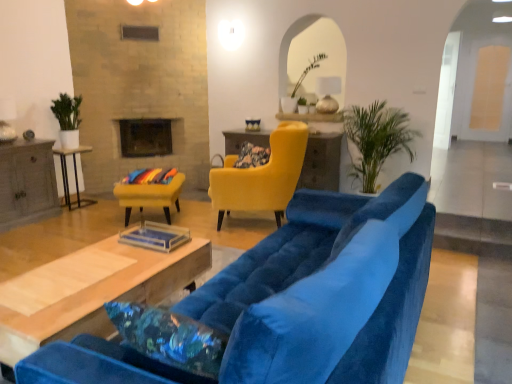
Question: Is matte yellow armchair at center, marked as the 2th chair in a left-to-right arrangement, to the right of black glass fireplace at upper center from the viewer's perspective?

Choices:
 (A) no
 (B) yes

Answer: (B)

Question: Is matte yellow armchair at center, marked as the 2th chair in a left-to-right arrangement, facing towards black glass fireplace at upper center?

Choices:
 (A) no
 (B) yes

Answer: (A)

Question: Can you confirm if matte yellow armchair at center, marked as the 2th chair in a left-to-right arrangement, is thinner than black glass fireplace at upper center?

Choices:
 (A) no
 (B) yes

Answer: (A)

Question: From the image's perspective, is matte yellow armchair at center, the 1th chair positioned from the right, over black glass fireplace at upper center?

Choices:
 (A) yes
 (B) no

Answer: (B)

Question: Is black glass fireplace at upper center surrounded by matte yellow armchair at center, the 1th chair positioned from the right?

Choices:
 (A) no
 (B) yes

Answer: (A)

Question: Based on their positions, is white glossy side table at left, which is the second table in left-to-right order, located to the left or right of wooden coffee table at center, acting as the 4th table starting from the back?

Choices:
 (A) right
 (B) left

Answer: (B)

Question: Considering the positions of white glossy side table at left, which is the second table in left-to-right order, and wooden coffee table at center, arranged as the first table when viewed from the front, in the image, is white glossy side table at left, which is the second table in left-to-right order, bigger or smaller than wooden coffee table at center, arranged as the first table when viewed from the front,?

Choices:
 (A) small
 (B) big

Answer: (A)

Question: From the image's perspective, is white glossy side table at left, arranged as the 2th table when viewed from the back, positioned above or below wooden coffee table at center, the 3th table positioned from the left?

Choices:
 (A) above
 (B) below

Answer: (A)

Question: Is white glossy side table at left, the 3th table when ordered from right to left, taller or shorter than wooden coffee table at center, acting as the 4th table starting from the back?

Choices:
 (A) tall
 (B) short

Answer: (A)

Question: Is floral fabric pillow at center inside or outside of wooden coffee table at center, marked as the second table in a right-to-left arrangement?

Choices:
 (A) inside
 (B) outside

Answer: (B)

Question: Considering the positions of point (236, 165) and point (59, 281), is point (236, 165) closer or farther from the camera than point (59, 281)?

Choices:
 (A) farther
 (B) closer

Answer: (A)

Question: From the image's perspective, is floral fabric pillow at center positioned above or below wooden coffee table at center, arranged as the first table when viewed from the front?

Choices:
 (A) above
 (B) below

Answer: (A)

Question: Would you say floral fabric pillow at center is to the left or to the right of wooden coffee table at center, acting as the 4th table starting from the back, in the picture?

Choices:
 (A) right
 (B) left

Answer: (A)

Question: Considering their positions, is black glass fireplace at upper center located in front of or behind velvet yellow armchair at center, the first chair in the left-to-right sequence?

Choices:
 (A) front
 (B) behind

Answer: (B)

Question: Would you say black glass fireplace at upper center is to the left or to the right of velvet yellow armchair at center, the first chair in the left-to-right sequence, in the picture?

Choices:
 (A) right
 (B) left

Answer: (B)